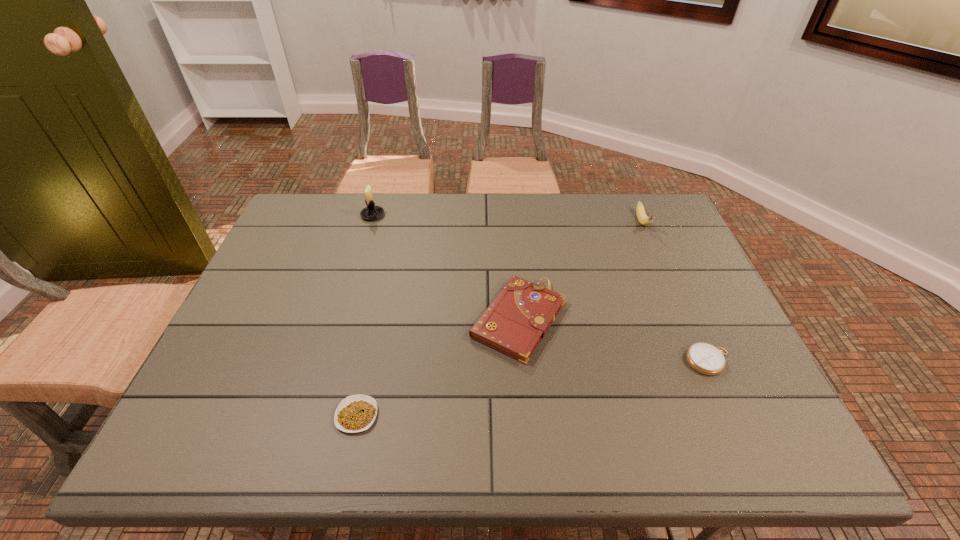
This screenshot has width=960, height=540. In order to click on vacant area situated 0.330m on the left of the third object from right to left in this screenshot , I will do `click(339, 320)`.

Find the location of a particular element. free space located 0.390m on the left of the compass is located at coordinates (518, 361).

This screenshot has width=960, height=540. In order to click on free region located on the back of the legume in this screenshot , I will do `click(369, 362)`.

Locate an element on the screen. candle holder that is at the far edge is located at coordinates (371, 212).

You are a GUI agent. You are given a task and a screenshot of the screen. Output one action in this format:
    pyautogui.click(x=<x>, y=<y>)
    Task: Click on the banana located in the far edge section of the desktop
    
    Given the screenshot: What is the action you would take?
    pyautogui.click(x=641, y=215)

The height and width of the screenshot is (540, 960). I want to click on object located in the near edge section of the desktop, so click(356, 413).

What are the coordinates of `banana at the right edge` in the screenshot? It's located at (641, 215).

Identify the location of compass at the right edge. (704, 358).

Find the location of a particular element. object present at the far right corner is located at coordinates (641, 215).

The height and width of the screenshot is (540, 960). Find the location of `free space at the far edge`. free space at the far edge is located at coordinates (422, 224).